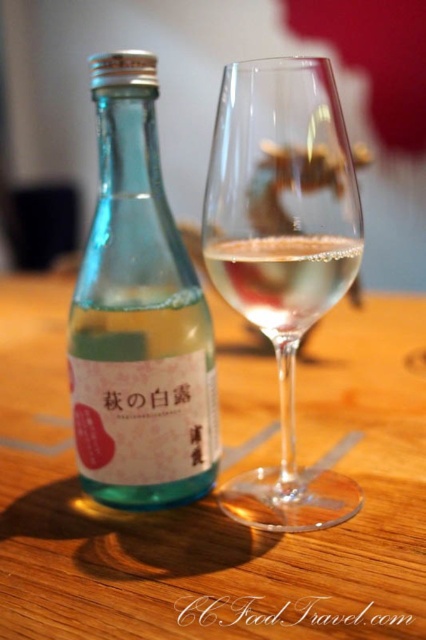
Is wooden table at center wider than transparent glass at upper center?

Correct, the width of wooden table at center exceeds that of transparent glass at upper center.

Between wooden table at center and transparent glass at upper center, which one appears on the right side from the viewer's perspective?

wooden table at center is more to the right.

Who is more distant from viewer, (227, 531) or (161, 397)?

The point (161, 397) is behind.

The width and height of the screenshot is (426, 640). Identify the location of wooden table at center. (215, 500).

Does transparent glass at upper center have a lesser height compared to clear glass wine at center?

Incorrect, transparent glass at upper center's height does not fall short of clear glass wine at center's.

Consider the image. Can you confirm if transparent glass at upper center is taller than clear glass wine at center?

Yes, transparent glass at upper center is taller than clear glass wine at center.

Between point (163, 337) and point (227, 257), which one is positioned in front?

Point (227, 257)

Locate an element on the screen. The image size is (426, 640). transparent glass at upper center is located at coordinates (144, 401).

Does transparent glass bottle at left have a larger size compared to clear glass wine at center?

Correct, transparent glass bottle at left is larger in size than clear glass wine at center.

This screenshot has width=426, height=640. Find the location of `transparent glass bottle at left`. transparent glass bottle at left is located at coordinates (138, 317).

You are a GUI agent. You are given a task and a screenshot of the screen. Output one action in this format:
    pyautogui.click(x=<x>, y=<y>)
    Task: Click on the transparent glass bottle at left
    This screenshot has width=426, height=640.
    Given the screenshot: What is the action you would take?
    pyautogui.click(x=138, y=317)